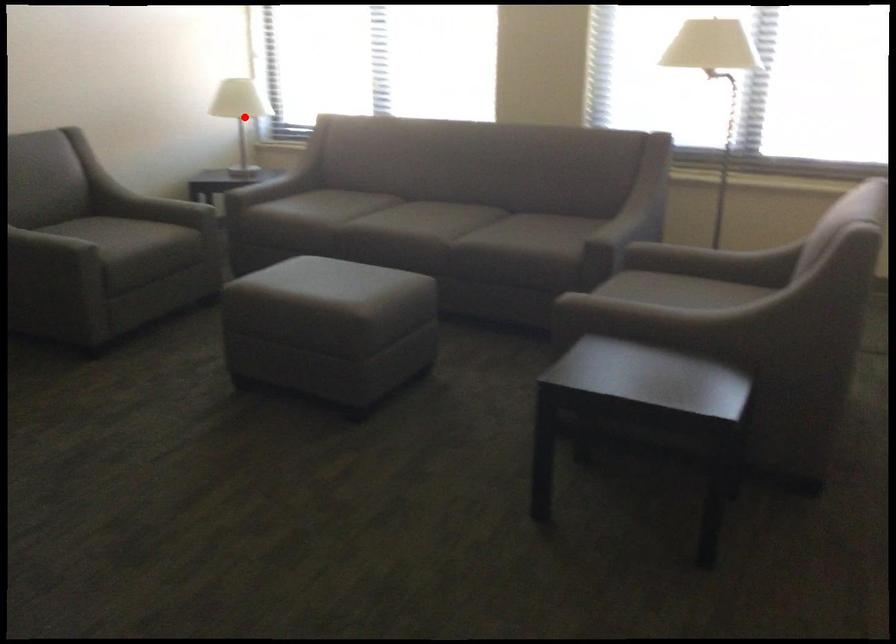
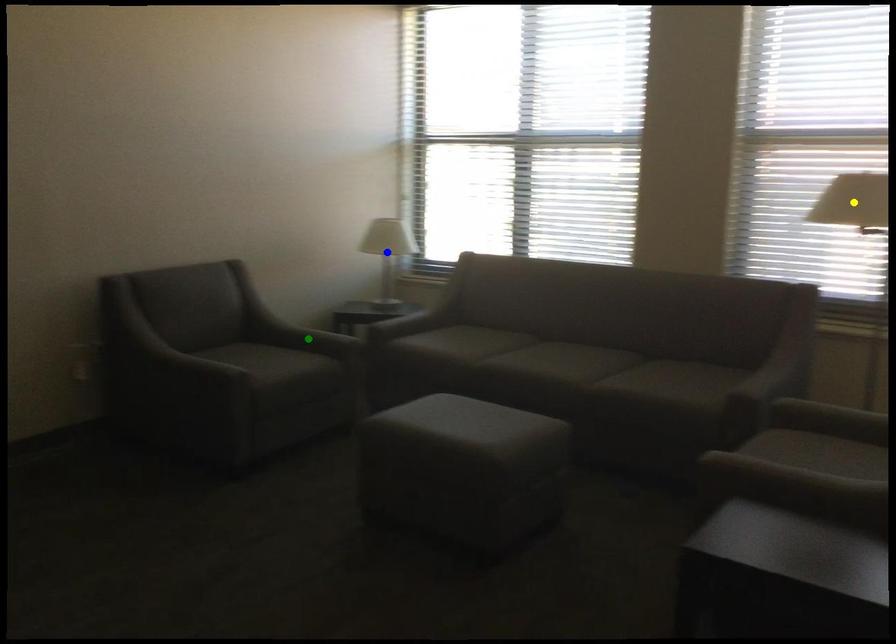
Question: I am providing you with two images of the same scene from different viewpoints. A red point is marked on the first image. You are given multiple points on the second image. Which point in image 2 represents the same 3d spot as the red point in image 1?

Choices:
 (A) green point
 (B) blue point
 (C) yellow point

Answer: (B)